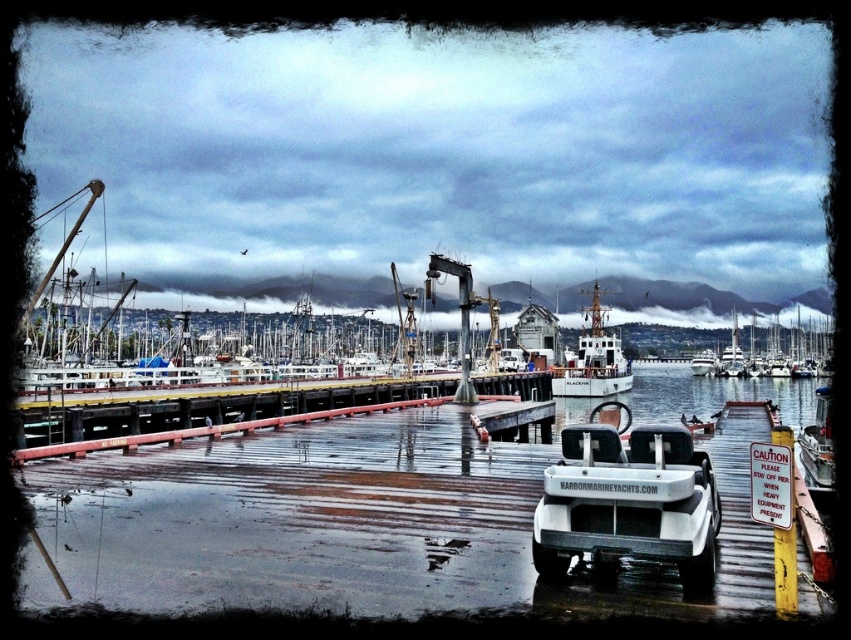
Question: Which object appears farthest from the camera in this image?

Choices:
 (A) white matte ship at center
 (B) white glossy boat at right

Answer: (A)

Question: Does white matte golf cart at center have a lesser width compared to white glossy boat at right?

Choices:
 (A) yes
 (B) no

Answer: (A)

Question: Can you confirm if white matte golf cart at center is positioned to the right of white glossy sailboat at upper right?

Choices:
 (A) yes
 (B) no

Answer: (B)

Question: Which object is closer to the camera taking this photo?

Choices:
 (A) white matte golf cart at center
 (B) white glossy boat at right
 (C) smooth wooden dock at center

Answer: (A)

Question: Does smooth wooden dock at center have a lesser width compared to white matte ship at center?

Choices:
 (A) no
 (B) yes

Answer: (A)

Question: Estimate the real-world distances between objects in this image. Which object is closer to the white glossy sailboat at upper right?

Choices:
 (A) white matte ship at center
 (B) white matte golf cart at center
 (C) smooth wooden dock at center

Answer: (A)